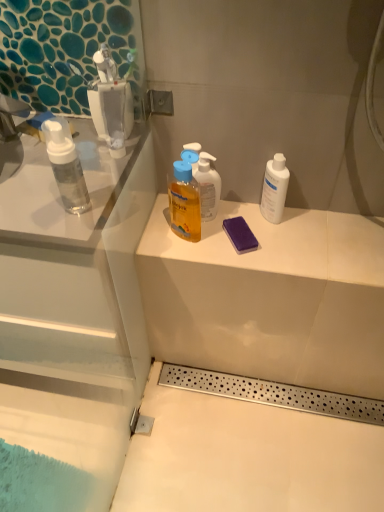
You are a GUI agent. You are given a task and a screenshot of the screen. Output one action in this format:
    pyautogui.click(x=<x>, y=<y>)
    Task: Click on the vacant area that lies between translucent yellow liquid at upper center and white matte bottle at right
    The height and width of the screenshot is (512, 384).
    Given the screenshot: What is the action you would take?
    pyautogui.click(x=233, y=225)